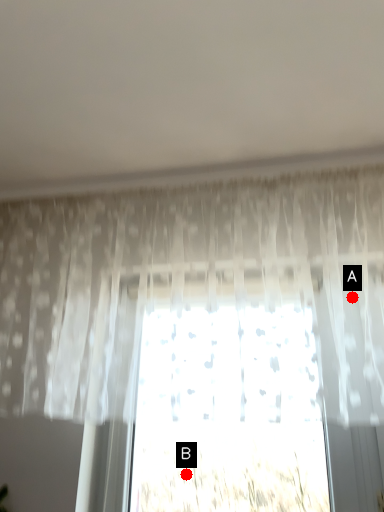
Question: Two points are circled on the image, labeled by A and B beside each circle. Which point appears farthest from the camera in this image?

Choices:
 (A) A is further
 (B) B is further

Answer: (A)